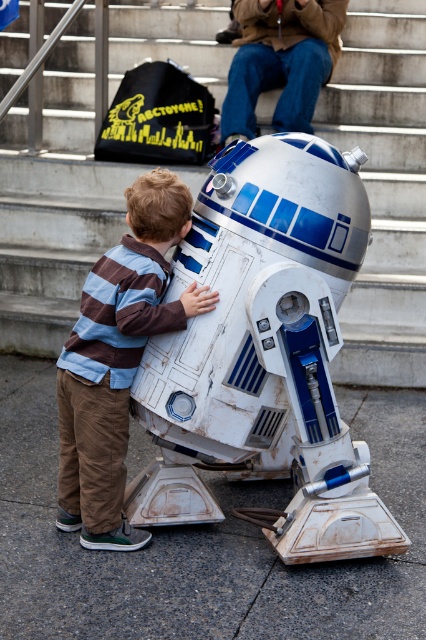
You are a photographer trying to capture the perfect shot of the white matte robot at center. If you want to position your camera exactly at the robot, what coordinates should you aim for?

The white matte robot at center is located at coordinates point (383,186), so you should aim your camera at those coordinates to capture the perfect shot.

In the scene where a child is hugging an R2 D2 droid, which object is taller between the white matte robot at center and the striped cotton shirt at center?

The white matte robot at center is taller than the striped cotton shirt at center.

You are a photographer at a Star Wars event and want to capture a closeup shot of the white matte robot at center and the striped cotton shirt at center. The camera can only focus on objects within 2 meters. Will both subjects be in focus?

The white matte robot at center is 2.69 meters away from striped cotton shirt at center. Since the camera requires both subjects to be within 2 meters of each other for proper focus, the distance between them exceeds the limit. Therefore, they cannot both be in focus simultaneously.